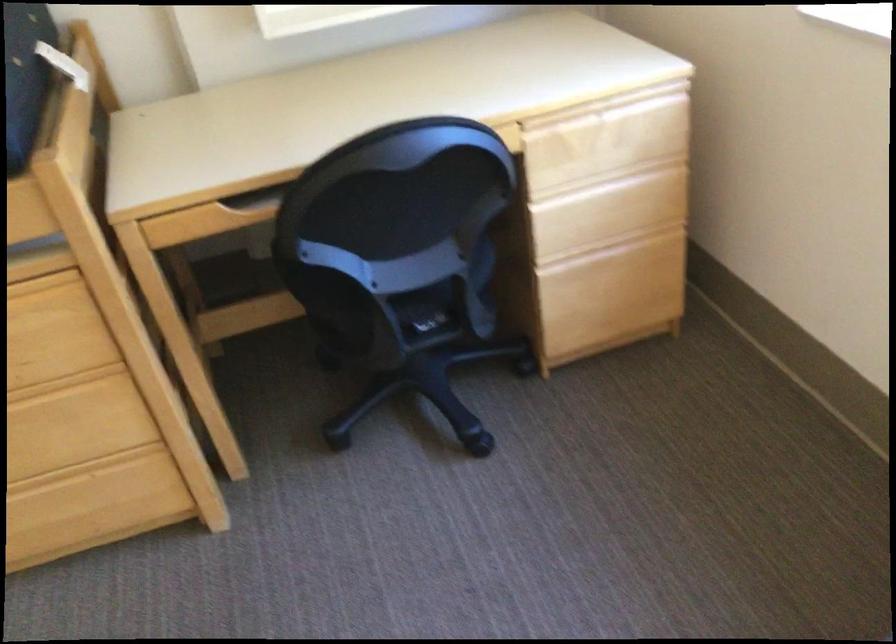
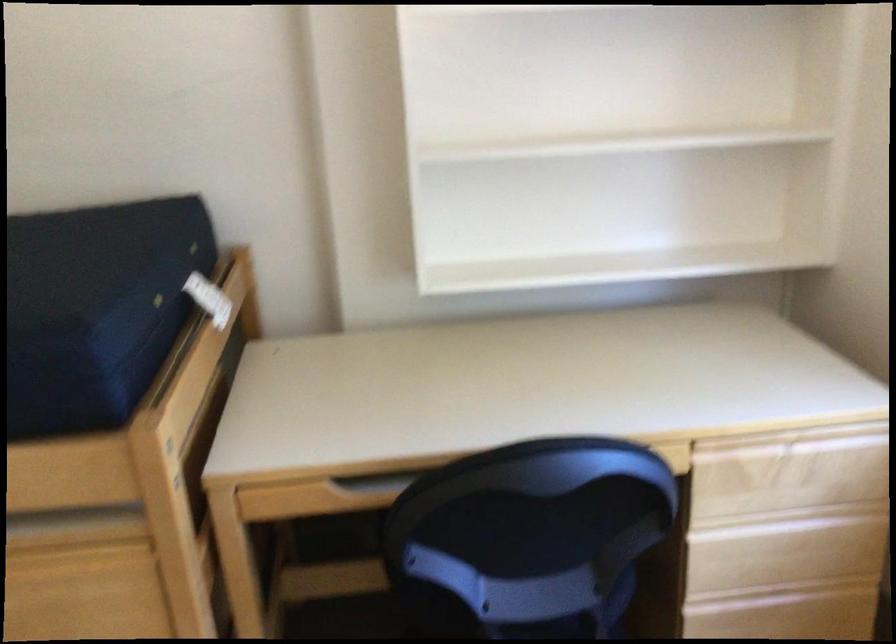
Question: The images are taken continuously from a first-person perspective. In which direction is your viewpoint rotating?

Choices:
 (A) Left
 (B) Right
 (C) Up
 (D) Down

Answer: (C)